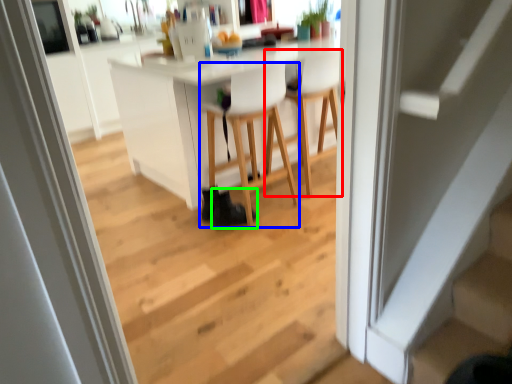
Question: Estimate the real-world distances between objects in this image. Which object is closer to chair (highlighted by a red box), chair (highlighted by a blue box) or shoe (highlighted by a green box)?

Choices:
 (A) chair
 (B) shoe

Answer: (A)